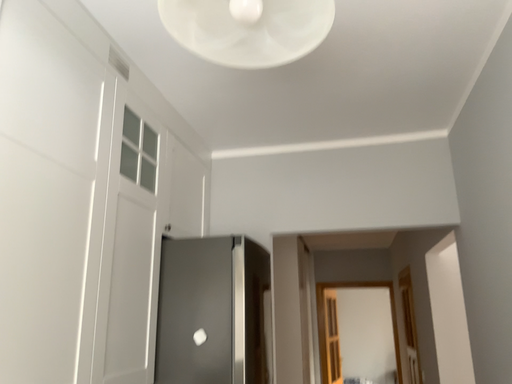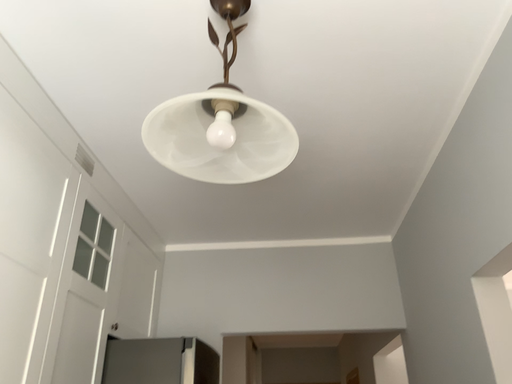
Question: How did the camera likely rotate when shooting the video?

Choices:
 (A) rotated right
 (B) rotated left

Answer: (A)